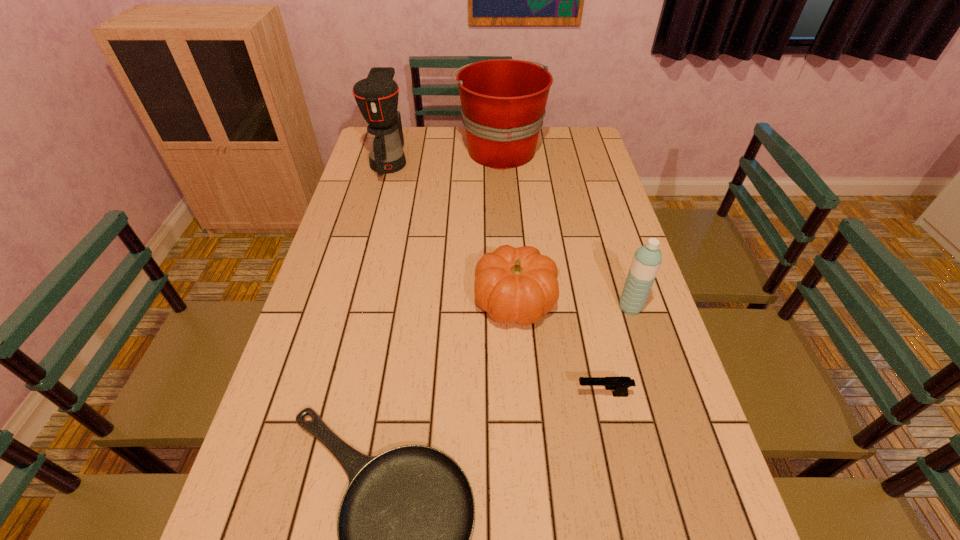
Locate an element on the screen. The height and width of the screenshot is (540, 960). vacant space positioned on the right of the pumpkin is located at coordinates (612, 301).

At what (x,y) coordinates should I click in order to perform the action: click on free region located on the front-facing side of the fifth farthest object. Please return your answer as a coordinate pair (x, y). This screenshot has width=960, height=540. Looking at the image, I should click on (493, 394).

This screenshot has height=540, width=960. I want to click on vacant region located on the front-facing side of the fifth farthest object, so click(457, 394).

This screenshot has width=960, height=540. Find the location of `free location located on the front-facing side of the fifth farthest object`. free location located on the front-facing side of the fifth farthest object is located at coordinates (416, 394).

Where is `coffee maker at the far edge`? The height and width of the screenshot is (540, 960). coffee maker at the far edge is located at coordinates pos(377,95).

Find the location of a particular element. bucket at the far edge is located at coordinates (503, 101).

Find the location of a particular element. Image resolution: width=960 pixels, height=540 pixels. object located at the left edge is located at coordinates (377, 95).

Image resolution: width=960 pixels, height=540 pixels. In order to click on water bottle situated at the right edge in this screenshot , I will do (647, 259).

You are a GUI agent. You are given a task and a screenshot of the screen. Output one action in this format:
    pyautogui.click(x=<x>, y=<y>)
    Task: Click on the pistol that is at the right edge
    
    Given the screenshot: What is the action you would take?
    pyautogui.click(x=620, y=385)

The width and height of the screenshot is (960, 540). I want to click on object at the far left corner, so click(377, 95).